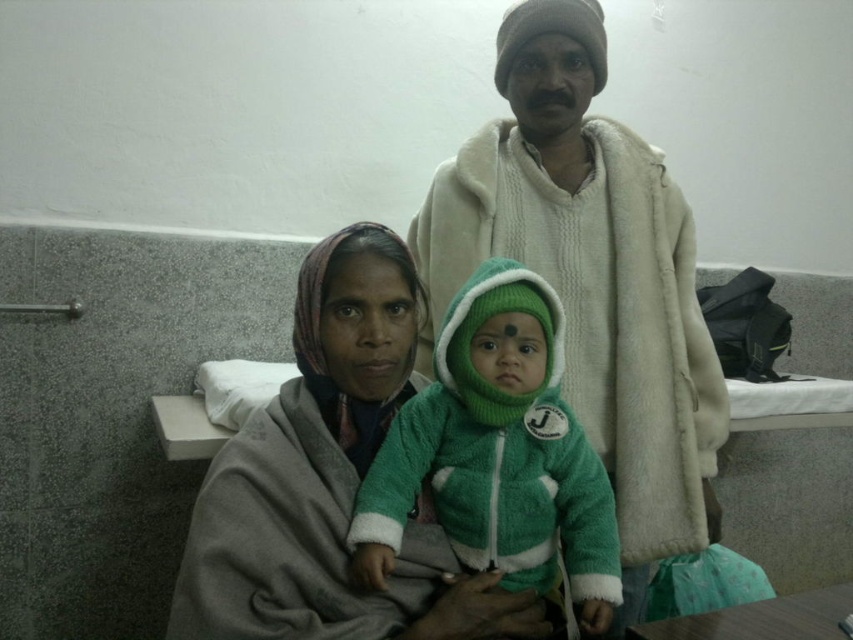
Is gray woolen shawl at center thinner than green fuzzy jacket at center?

No.

Can you confirm if gray woolen shawl at center is wider than green fuzzy jacket at center?

Indeed, gray woolen shawl at center has a greater width compared to green fuzzy jacket at center.

Is point (494, 596) positioned after point (378, 506)?

Yes.

Where is `gray woolen shawl at center`? The height and width of the screenshot is (640, 853). gray woolen shawl at center is located at coordinates (329, 481).

In the scene shown: Who is lower down, white fuzzy coat at upper center or gray woolen shawl at center?

gray woolen shawl at center is below.

Does white fuzzy coat at upper center appear under gray woolen shawl at center?

Incorrect, white fuzzy coat at upper center is not positioned below gray woolen shawl at center.

Is point (698, 390) farther from viewer compared to point (248, 456)?

Yes, point (698, 390) is farther from viewer.

Where is `white fuzzy coat at upper center`? white fuzzy coat at upper center is located at coordinates (590, 276).

Between white fuzzy coat at upper center and green fuzzy jacket at center, which one is positioned lower?

green fuzzy jacket at center

Is white fuzzy coat at upper center thinner than green fuzzy jacket at center?

No, white fuzzy coat at upper center is not thinner than green fuzzy jacket at center.

This screenshot has height=640, width=853. I want to click on white fuzzy coat at upper center, so click(590, 276).